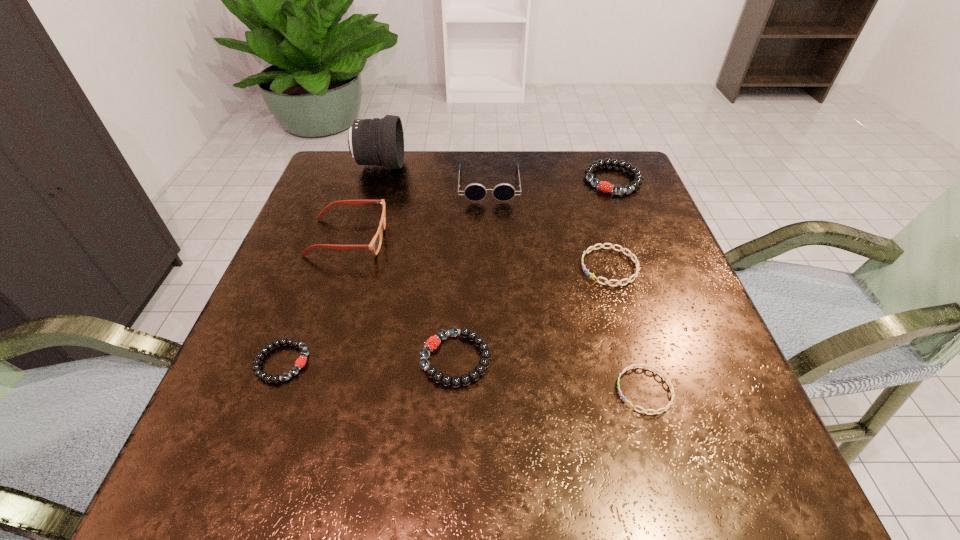
Locate an element on the screen. The height and width of the screenshot is (540, 960). the tallest object is located at coordinates (376, 141).

Identify the location of telephoto lens. (376, 141).

This screenshot has height=540, width=960. Identify the location of sunglasses. (475, 192).

Where is `brown spectacles`? The image size is (960, 540). brown spectacles is located at coordinates (375, 244).

I want to click on the fourth tallest object, so click(x=604, y=186).

Identify the location of the tallest bracelet. This screenshot has height=540, width=960. (604, 186).

Locate an element on the screen. the fourth shortest bracelet is located at coordinates (433, 342).

In order to click on the fourth bracelet from right to left in this screenshot , I will do `click(433, 342)`.

Where is `the fourth nearest bracelet`? Image resolution: width=960 pixels, height=540 pixels. the fourth nearest bracelet is located at coordinates (636, 261).

The image size is (960, 540). What are the coordinates of `the bigger blue bracelet` in the screenshot? It's located at (636, 261).